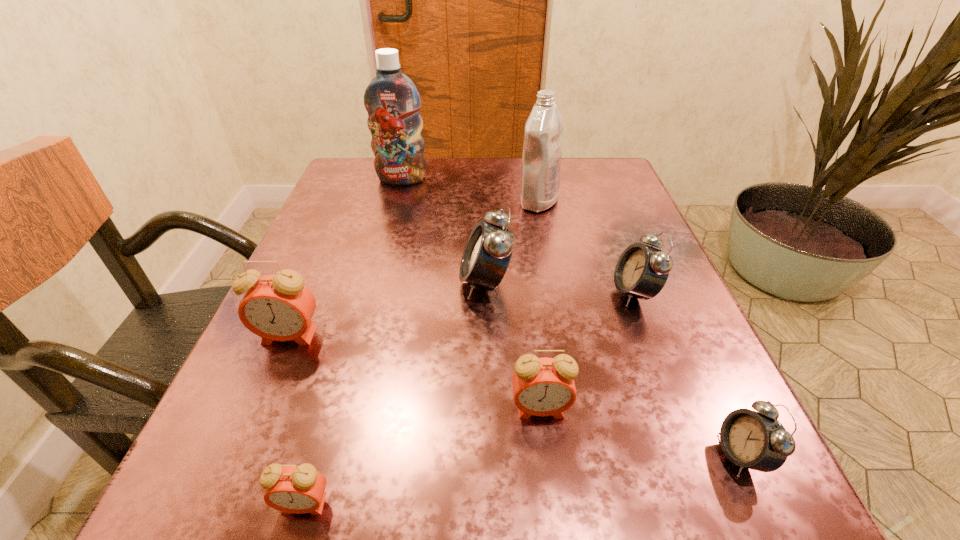
At what (x,y) coordinates should I click in order to perform the action: click on object that is at the far left corner. Please return your answer as a coordinate pair (x, y). The height and width of the screenshot is (540, 960). Looking at the image, I should click on (392, 101).

This screenshot has width=960, height=540. Find the location of `object that is at the near left corner`. object that is at the near left corner is located at coordinates (300, 489).

The height and width of the screenshot is (540, 960). What are the coordinates of `object present at the near right corner` in the screenshot? It's located at (755, 440).

The width and height of the screenshot is (960, 540). Find the location of `blank space at the far edge of the desktop`. blank space at the far edge of the desktop is located at coordinates (430, 158).

At what (x,y) coordinates should I click in order to perform the action: click on free space at the near edge of the desktop. Please return your answer as a coordinate pair (x, y). The height and width of the screenshot is (540, 960). Looking at the image, I should click on click(x=491, y=537).

Identify the location of blank space at the left edge. Image resolution: width=960 pixels, height=540 pixels. (283, 433).

Identify the location of vacant region at the right edge of the desktop. (x=590, y=241).

I want to click on vacant space at the far left corner, so click(331, 192).

Identify the location of vacant space at the far right corner of the desktop. (575, 157).

Where is `blank space at the near right corner of the desktop`? blank space at the near right corner of the desktop is located at coordinates (697, 519).